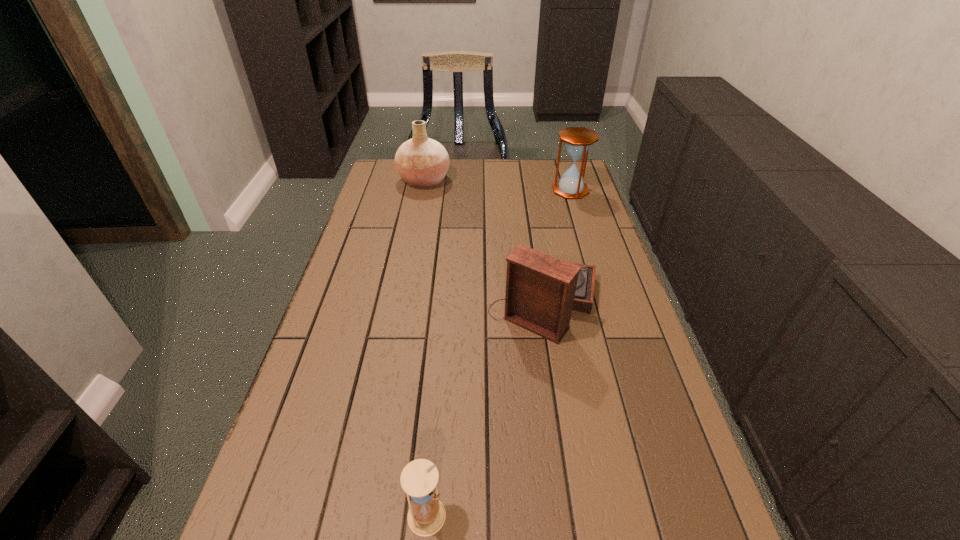
Where is `pottery present at the far edge`? pottery present at the far edge is located at coordinates (422, 162).

The height and width of the screenshot is (540, 960). What are the coordinates of `hourglass that is at the far edge` in the screenshot? It's located at (577, 140).

This screenshot has width=960, height=540. Find the location of `object that is at the left edge`. object that is at the left edge is located at coordinates (422, 162).

Where is `hourglass located at the right edge`? hourglass located at the right edge is located at coordinates 577,140.

At what (x,y) coordinates should I click in order to perform the action: click on phonograph record that is at the right edge. Please return your answer as a coordinate pair (x, y). Looking at the image, I should click on (541, 291).

The image size is (960, 540). I want to click on object that is at the far left corner, so click(x=422, y=162).

In order to click on object present at the far right corner in this screenshot , I will do `click(577, 140)`.

I want to click on vacant space at the left edge of the desktop, so click(x=328, y=339).

Where is `free space at the right edge`? This screenshot has width=960, height=540. free space at the right edge is located at coordinates (593, 312).

Identify the location of empty space that is in between the nearer hourglass and the second nearest object. This screenshot has width=960, height=540. (486, 409).